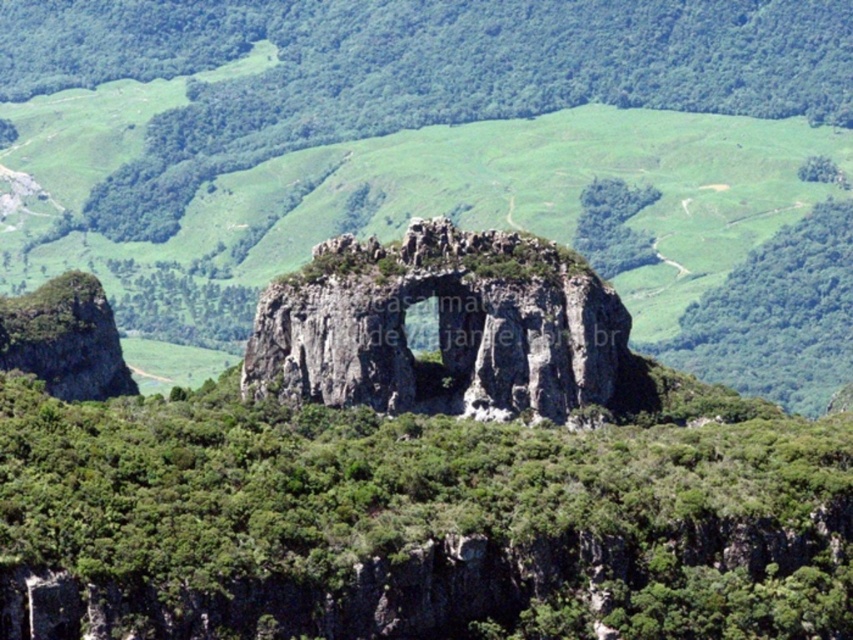
Question: Among these points, which one is farthest from the camera?

Choices:
 (A) (445, 353)
 (B) (521, 188)

Answer: (B)

Question: Does rugged stone arch at center have a smaller size compared to gray rocky arch at center?

Choices:
 (A) no
 (B) yes

Answer: (A)

Question: Does green leafy vegetation at center appear under gray rocky arch at center?

Choices:
 (A) no
 (B) yes

Answer: (B)

Question: Considering the real-world distances, which object is closest to the green leafy vegetation at center?

Choices:
 (A) rugged stone arch at center
 (B) gray rocky arch at center

Answer: (B)

Question: Does rugged stone arch at center appear under green leafy vegetation at center?

Choices:
 (A) yes
 (B) no

Answer: (B)

Question: Based on their relative distances, which object is farther from the rugged stone arch at center?

Choices:
 (A) green leafy vegetation at center
 (B) gray rocky arch at center

Answer: (A)